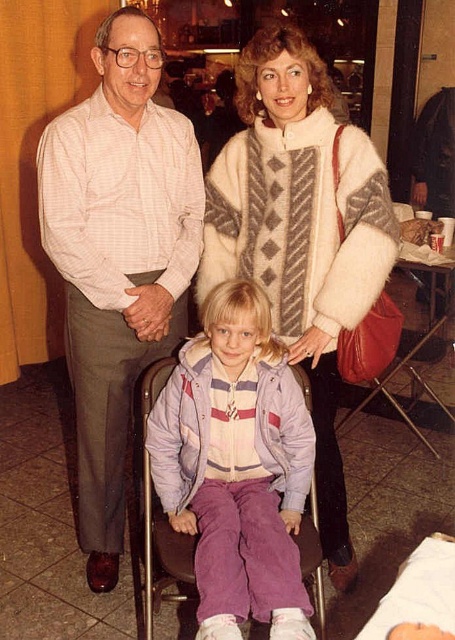
This screenshot has width=455, height=640. I want to click on light pink checkered shirt at center, so 117,257.

Measure the distance between point (111, 577) and camera.

A distance of 7.28 feet exists between point (111, 577) and camera.

This screenshot has width=455, height=640. I want to click on light pink checkered shirt at center, so click(x=117, y=257).

The width and height of the screenshot is (455, 640). Identify the location of fuzzy white coat at upper center. (302, 234).

Can you confirm if fuzzy white coat at upper center is thinner than purple corduroy pants at center?

No, fuzzy white coat at upper center is not thinner than purple corduroy pants at center.

Find the location of `fuzzy white coat at upper center`. fuzzy white coat at upper center is located at coordinates (302, 234).

Which is below, light pink checkered shirt at center or purple corduroy pants at center?

purple corduroy pants at center is below.

Measure the distance between light pink checkered shirt at center and purple corduroy pants at center.

light pink checkered shirt at center is 20.82 inches away from purple corduroy pants at center.

Which is behind, point (130, 280) or point (157, 484)?

The point (130, 280) is behind.

Locate an element on the screen. The width and height of the screenshot is (455, 640). light pink checkered shirt at center is located at coordinates (117, 257).